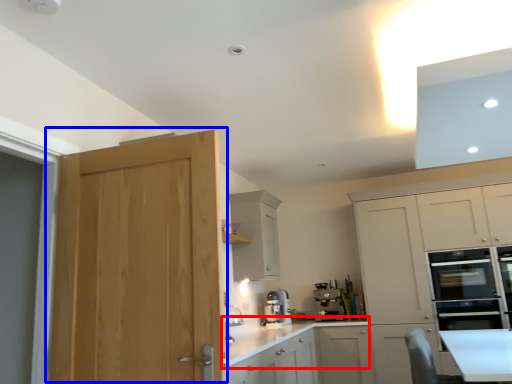
Question: Which object is closer to the camera taking this photo, countertop (highlighted by a red box) or door (highlighted by a blue box)?

Choices:
 (A) countertop
 (B) door

Answer: (B)